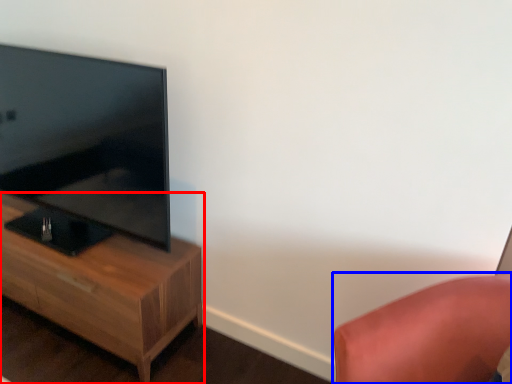
Question: Which of the following is the closest to the observer, nightstand (highlighted by a red box) or furniture (highlighted by a blue box)?

Choices:
 (A) nightstand
 (B) furniture

Answer: (B)